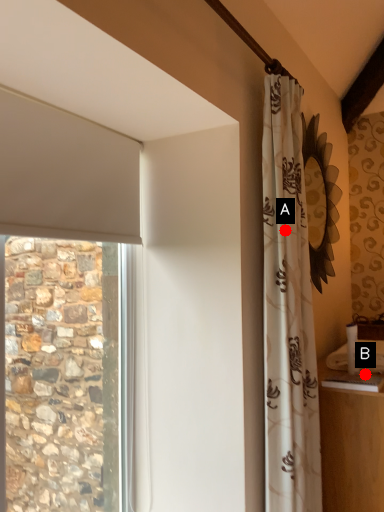
Question: Two points are circled on the image, labeled by A and B beside each circle. Which point is farther from the camera taking this photo?

Choices:
 (A) A is further
 (B) B is further

Answer: (B)